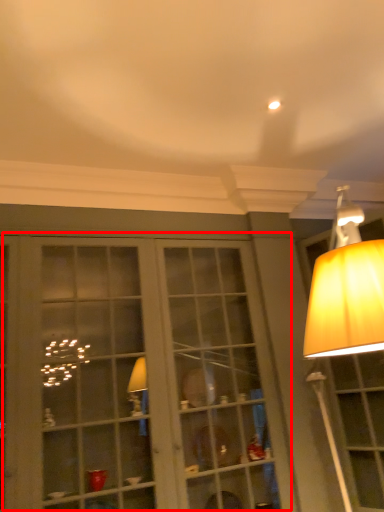
Question: Where is bay window (annotated by the red box) located in relation to lamp in the image?

Choices:
 (A) left
 (B) right

Answer: (A)